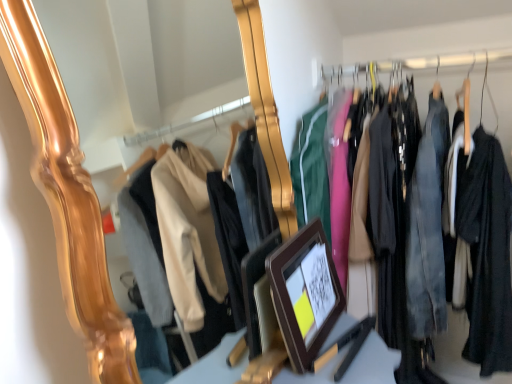
Question: Is matte black jackets at center wider than brown wooden picture frame at center?

Choices:
 (A) yes
 (B) no

Answer: (A)

Question: Does matte black jackets at center have a lesser height compared to brown wooden picture frame at center?

Choices:
 (A) no
 (B) yes

Answer: (A)

Question: Does matte black jackets at center have a lesser width compared to brown wooden picture frame at center?

Choices:
 (A) no
 (B) yes

Answer: (A)

Question: Is matte black jackets at center positioned with its back to brown wooden picture frame at center?

Choices:
 (A) no
 (B) yes

Answer: (A)

Question: From a real-world perspective, is matte black jackets at center under brown wooden picture frame at center?

Choices:
 (A) yes
 (B) no

Answer: (B)

Question: Is matte black jackets at center not near brown wooden picture frame at center?

Choices:
 (A) no
 (B) yes

Answer: (A)

Question: Can you confirm if brown wooden picture frame at center is smaller than matte black jackets at center?

Choices:
 (A) yes
 (B) no

Answer: (A)

Question: Considering the relative sizes of brown wooden picture frame at center and matte black jackets at center in the image provided, is brown wooden picture frame at center taller than matte black jackets at center?

Choices:
 (A) yes
 (B) no

Answer: (B)

Question: Can matte black jackets at center be found inside brown wooden picture frame at center?

Choices:
 (A) no
 (B) yes

Answer: (A)

Question: Is brown wooden picture frame at center oriented away from matte black jackets at center?

Choices:
 (A) yes
 (B) no

Answer: (B)

Question: Does brown wooden picture frame at center come behind matte black jackets at center?

Choices:
 (A) no
 (B) yes

Answer: (A)

Question: From the image's perspective, is brown wooden picture frame at center above matte black jackets at center?

Choices:
 (A) no
 (B) yes

Answer: (A)

Question: From their relative heights in the image, would you say matte black jackets at center is taller or shorter than brown wooden picture frame at center?

Choices:
 (A) short
 (B) tall

Answer: (B)